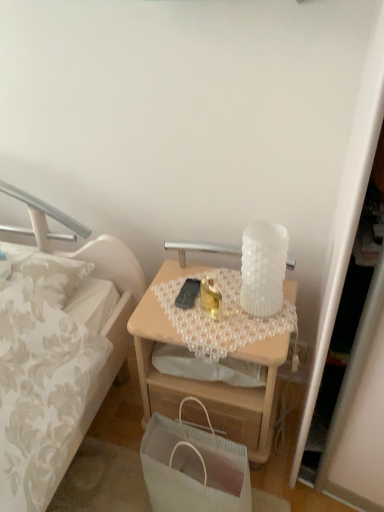
This screenshot has width=384, height=512. Identify the location of free space in front of white textured glass at upper center. coord(224,317).